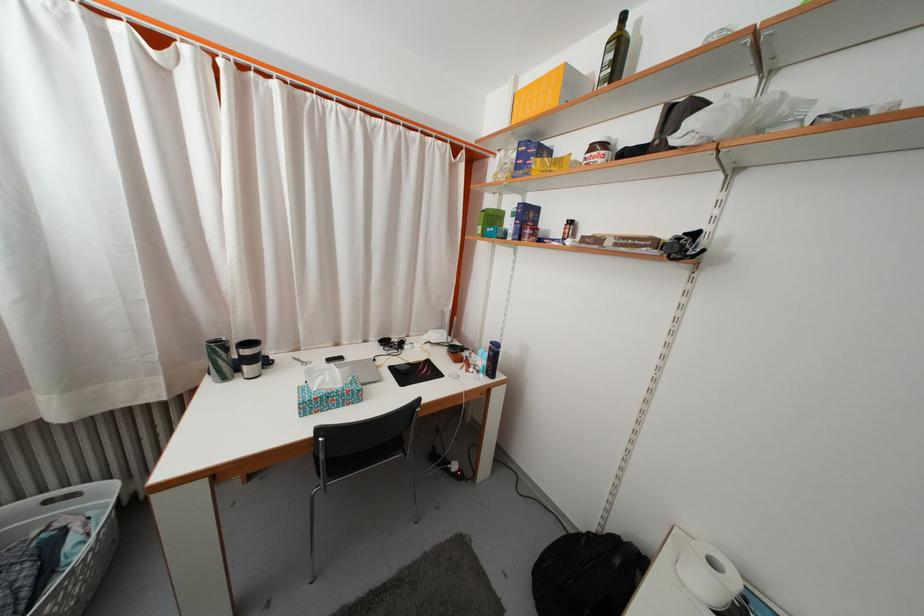
Where is `green glass bottle`? This screenshot has width=924, height=616. green glass bottle is located at coordinates (614, 53).